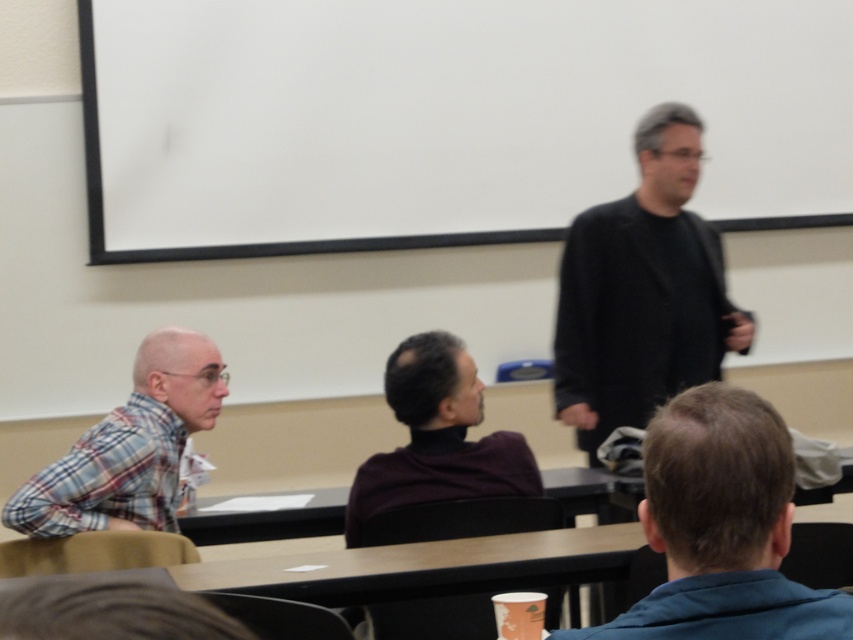
Where is `dark purple turtleneck sweater at center`? Image resolution: width=853 pixels, height=640 pixels. dark purple turtleneck sweater at center is located at coordinates (440, 456).

Who is shorter, dark purple turtleneck sweater at center or plaid fabric shirt at left?

Standing shorter between the two is plaid fabric shirt at left.

Is point (389, 627) farther from viewer compared to point (123, 458)?

No, it is in front of (123, 458).

Identify the location of dark purple turtleneck sweater at center. (440, 456).

Is black matte jacket at upper right further to camera compared to plaid fabric shirt at left?

Yes, it is.

Which is below, black matte jacket at upper right or plaid fabric shirt at left?

plaid fabric shirt at left is below.

At what (x,y) coordinates should I click in order to perform the action: click on black matte jacket at upper right. Please return your answer as a coordinate pair (x, y). Image resolution: width=853 pixels, height=640 pixels. Looking at the image, I should click on (642, 291).

Who is taller, dark blue fabric at lower right or dark purple turtleneck sweater at center?

dark purple turtleneck sweater at center is taller.

Is point (695, 484) closer to viewer compared to point (363, 477)?

Yes.

At what (x,y) coordinates should I click in order to perform the action: click on dark blue fabric at lower right. Please return your answer as a coordinate pair (x, y). Looking at the image, I should click on (721, 528).